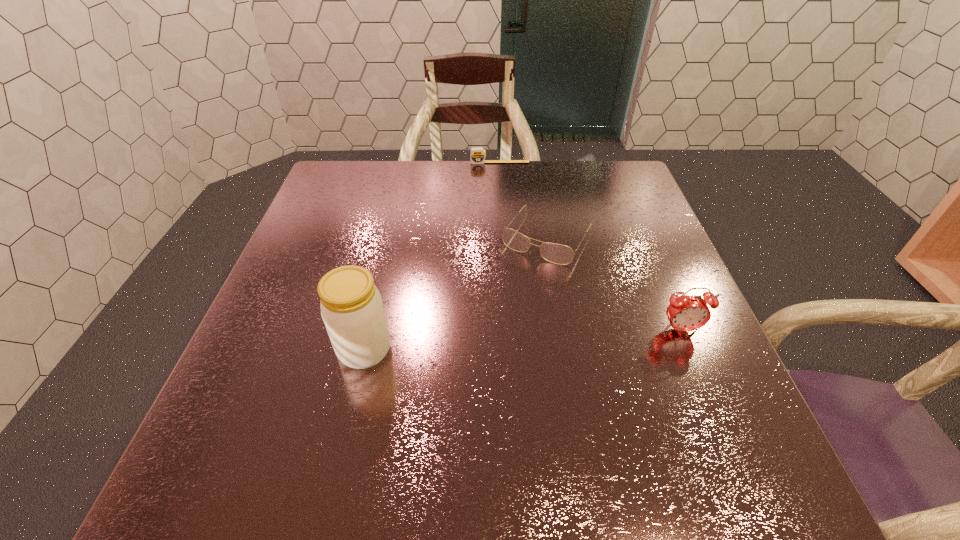
You are a GUI agent. You are given a task and a screenshot of the screen. Output one action in this format:
    pyautogui.click(x=<x>, y=<y>)
    Task: Click on the free space at the right edge of the desktop
    
    Given the screenshot: What is the action you would take?
    pyautogui.click(x=651, y=310)

You are a GUI agent. You are given a task and a screenshot of the screen. Output one action in this format:
    pyautogui.click(x=<x>, y=<y>)
    Task: Click on the free space at the far right corner of the desktop
    The image size is (960, 540).
    Given the screenshot: What is the action you would take?
    pyautogui.click(x=592, y=183)

Locate an element on the screen. vacant space at the near right corner of the desktop is located at coordinates (666, 417).

Where is `free space between the tape measure and the spectacles`? This screenshot has height=540, width=960. free space between the tape measure and the spectacles is located at coordinates (523, 200).

The height and width of the screenshot is (540, 960). Identify the location of free space between the tallest object and the rightmost object. (522, 340).

This screenshot has width=960, height=540. I want to click on free space between the third nearest object and the tape measure, so click(x=523, y=200).

At what (x,y) coordinates should I click in order to perform the action: click on free spot between the third nearest object and the leftmost object. Please return your answer as a coordinate pair (x, y). The height and width of the screenshot is (540, 960). Looking at the image, I should click on (456, 293).

Identify the location of free point between the shortest object and the third shortest object. This screenshot has height=540, width=960. (590, 246).

What are the coordinates of `empty location between the leftmost object and the second farthest object` in the screenshot? It's located at (456, 293).

The height and width of the screenshot is (540, 960). What are the coordinates of `free space between the spectacles and the tape measure` in the screenshot? It's located at (523, 200).